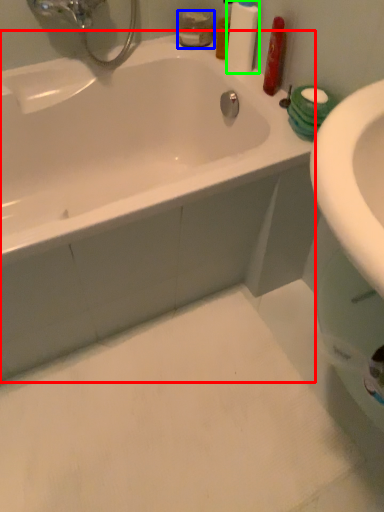
Question: Considering the real-world distances, which object is farthest from bathtub (highlighted by a red box)? mouthwash (highlighted by a blue box) or cleaning product (highlighted by a green box)?

Choices:
 (A) mouthwash
 (B) cleaning product

Answer: (A)